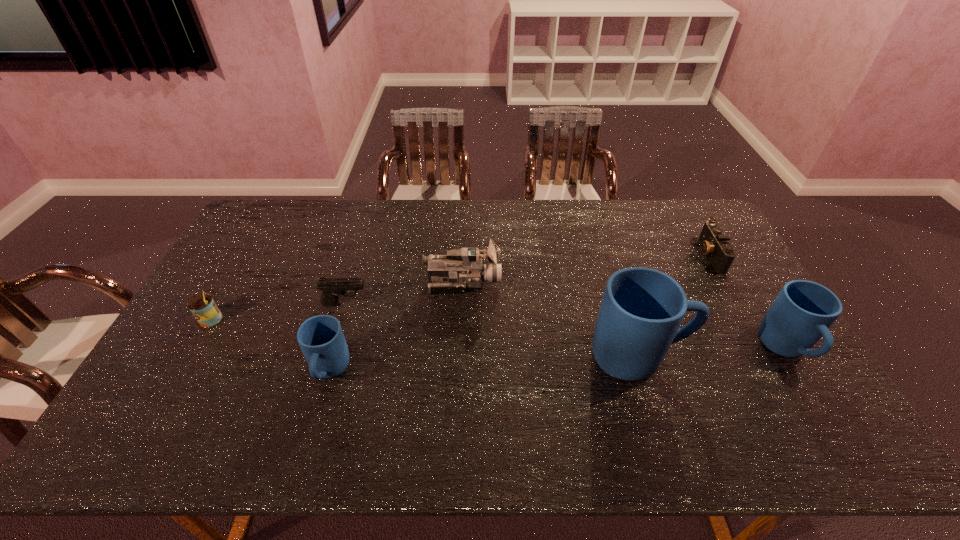
You are a GUI agent. You are given a task and a screenshot of the screen. Output one action in this format:
    pyautogui.click(x=<x>, y=<y>)
    Task: Click on the free point between the pistol and the leftmost object
    The width and height of the screenshot is (960, 540).
    Given the screenshot: What is the action you would take?
    pyautogui.click(x=277, y=312)

Locate an element on the screen. The image size is (960, 540). free space between the pistol and the can is located at coordinates pos(277,312).

Find the location of a particular element. The width and height of the screenshot is (960, 540). vacant area that lies between the pistol and the fourth object from left to right is located at coordinates (404, 293).

Choose which object is the second nearest neighbor to the third farthest object. Please provide its 2D coordinates. Your answer should be formatted as a tuple, i.e. [(x, y)], where the tuple contains the x and y coordinates of a point satisfying the conditions above.

[(462, 268)]

Locate which object is the third closest to the can. Please provide its 2D coordinates. Your answer should be formatted as a tuple, i.e. [(x, y)], where the tuple contains the x and y coordinates of a point satisfying the conditions above.

[(462, 268)]

The width and height of the screenshot is (960, 540). What are the coordinates of `the closest mug relative to the third farthest object` in the screenshot? It's located at (321, 339).

Select which mug is the third closest to the camcorder. Please provide its 2D coordinates. Your answer should be formatted as a tuple, i.e. [(x, y)], where the tuple contains the x and y coordinates of a point satisfying the conditions above.

[(803, 311)]

Where is `vacant point that satisfies the following two spatial constraints: 1. on the front-facing side of the fourth object from left to right; 2. on the front side of the leftmost object`? vacant point that satisfies the following two spatial constraints: 1. on the front-facing side of the fourth object from left to right; 2. on the front side of the leftmost object is located at coordinates (461, 320).

In order to click on free location that satisfies the following two spatial constraints: 1. on the side of the fifth object from left to right with the handle; 2. on the side of the shortest mug with the handle in this screenshot , I will do `click(643, 372)`.

You are a GUI agent. You are given a task and a screenshot of the screen. Output one action in this format:
    pyautogui.click(x=<x>, y=<y>)
    Task: Click on the vacant area that satisfies the following two spatial constraints: 1. on the front-facing side of the camcorder; 2. on the side of the shortest mug with the handle
    Image resolution: width=960 pixels, height=540 pixels.
    Given the screenshot: What is the action you would take?
    pyautogui.click(x=459, y=372)